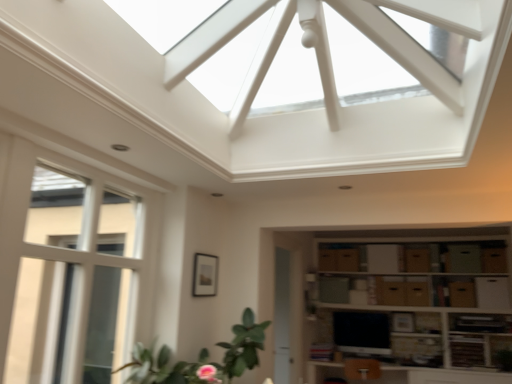
Question: Is brown cardboard boxes at lower right in front of or behind brown cardboard drawer at lower right, the sixth drawer positioned from the left, in the image?

Choices:
 (A) front
 (B) behind

Answer: (A)

Question: Based on their sizes in the image, would you say brown cardboard boxes at lower right is bigger or smaller than brown cardboard drawer at lower right, the sixth drawer positioned from the left?

Choices:
 (A) big
 (B) small

Answer: (A)

Question: Estimate the real-world distances between objects in this image. Which object is closer to the brown cardboard drawer at center, the third drawer in the left-to-right sequence?

Choices:
 (A) brown cardboard drawer at center, the fifth drawer positioned from the right
 (B) brown cardboard drawer at center-right, which appears as the 4th drawer when viewed from the left
 (C) brown cardboard drawer at center, the 1th drawer positioned from the left
 (D) white glass window at left
 (E) brown cardboard drawer at lower right, the 5th drawer in the left-to-right sequence

Answer: (A)

Question: Based on their relative distances, which object is nearer to the brown cardboard drawer at center-right, acting as the 3th drawer starting from the right?

Choices:
 (A) brown cardboard drawer at center, the fifth drawer positioned from the right
 (B) green leafy plant at lower left
 (C) brown cardboard drawer at lower right, the sixth drawer positioned from the left
 (D) white glass window at left
 (E) brown cardboard drawer at center, placed as the sixth drawer when sorted from right to left

Answer: (A)